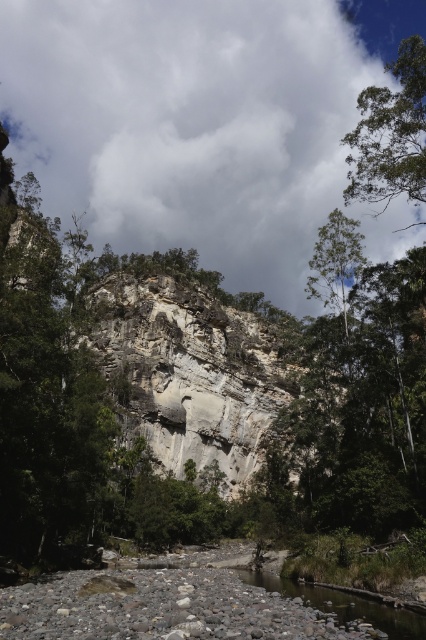
Question: Which point is closer to the camera?

Choices:
 (A) (186, 358)
 (B) (296, 592)
 (C) (423, 132)
 (D) (345, 102)

Answer: (B)

Question: Can you confirm if gray rock formation at center is bigger than smooth gravel river at lower center?

Choices:
 (A) yes
 (B) no

Answer: (A)

Question: Based on their relative distances, which object is farther from the white fluffy cloud at upper center?

Choices:
 (A) smooth gravel river at lower center
 (B) green leafy tree at upper right

Answer: (A)

Question: Is white fluffy cloud at upper center smaller than green leafy tree at upper right?

Choices:
 (A) yes
 (B) no

Answer: (B)

Question: Considering the real-world distances, which object is farthest from the smooth gravel river at lower center?

Choices:
 (A) white fluffy cloud at upper center
 (B) gray rock formation at center
 (C) green leafy tree at upper right

Answer: (A)

Question: Observing the image, what is the correct spatial positioning of gray rock formation at center in reference to smooth gravel river at lower center?

Choices:
 (A) above
 (B) below

Answer: (A)